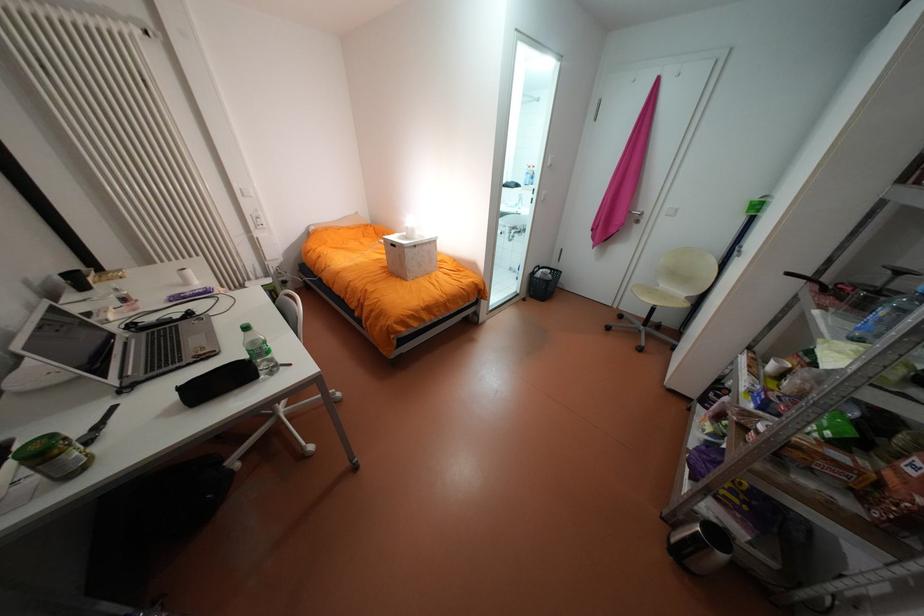
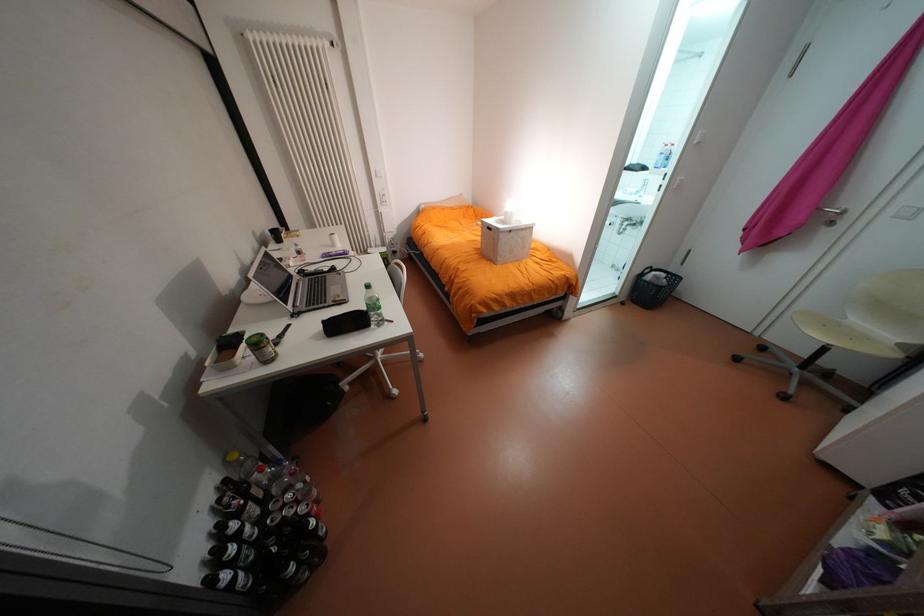
The point at (523, 230) is marked in the first image. Where is the corresponding point in the second image?

(636, 223)